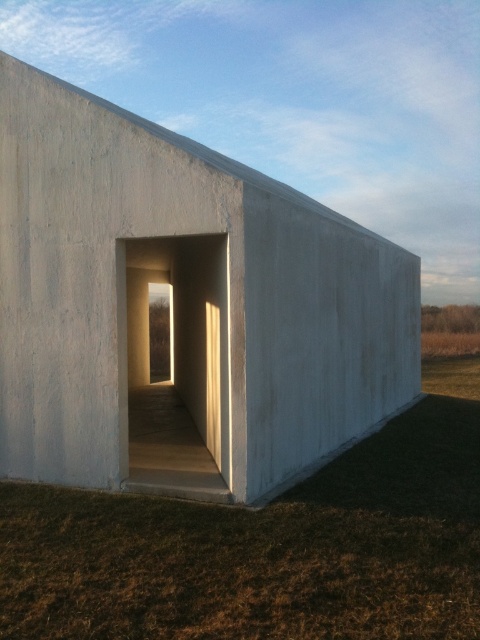
Does white concrete wall at center lie behind brown grass at lower center?

Yes, white concrete wall at center is further from the viewer.

Can you confirm if white concrete wall at center is positioned above brown grass at lower center?

Indeed, white concrete wall at center is positioned over brown grass at lower center.

Locate an element on the screen. The height and width of the screenshot is (640, 480). white concrete wall at center is located at coordinates (181, 308).